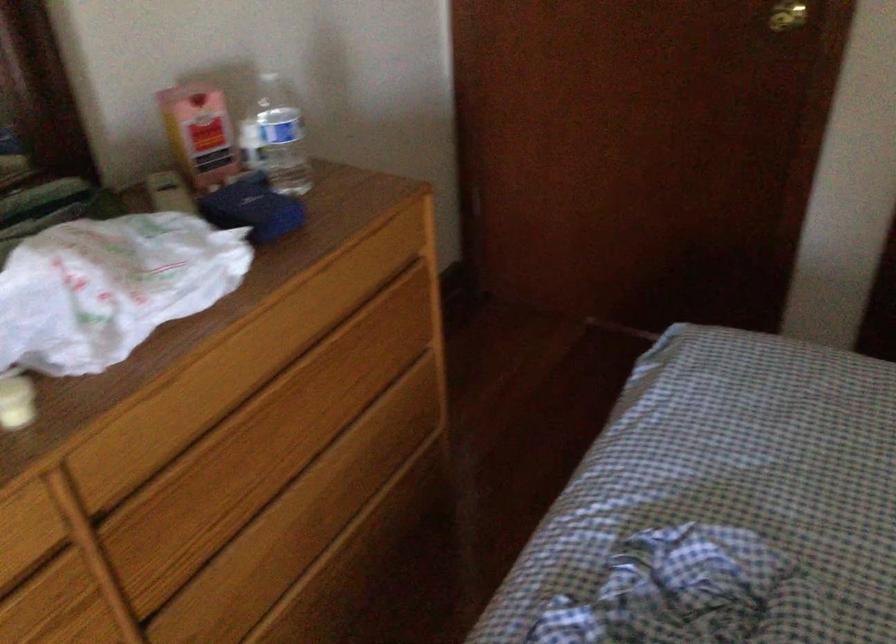
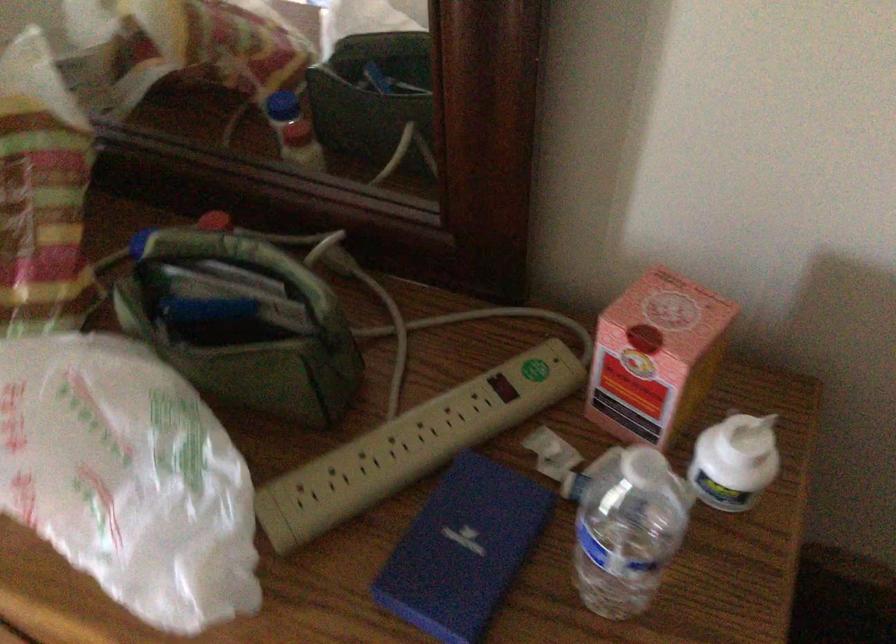
The point at (261, 133) is marked in the first image. Where is the corresponding point in the second image?

(735, 462)